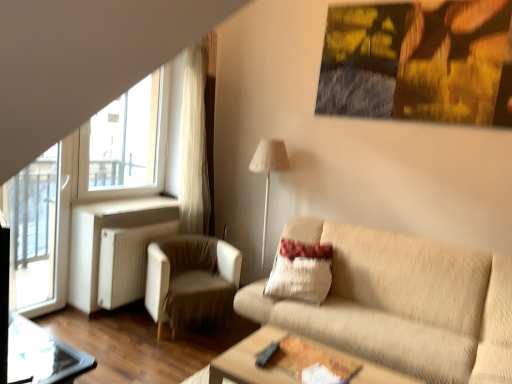
Question: From the image's perspective, is white fabric armchair at left on beige textured pillow at center?

Choices:
 (A) no
 (B) yes

Answer: (A)

Question: Considering the relative sizes of white fabric armchair at left and beige textured pillow at center in the image provided, is white fabric armchair at left wider than beige textured pillow at center?

Choices:
 (A) yes
 (B) no

Answer: (A)

Question: Is white fabric armchair at left at the right side of beige textured pillow at center?

Choices:
 (A) yes
 (B) no

Answer: (B)

Question: Does white fabric armchair at left have a smaller size compared to beige textured pillow at center?

Choices:
 (A) yes
 (B) no

Answer: (B)

Question: Is white fabric armchair at left taller than beige textured pillow at center?

Choices:
 (A) no
 (B) yes

Answer: (B)

Question: Relative to wooden table at lower center, is transparent glass table at lower left in front or behind?

Choices:
 (A) behind
 (B) front

Answer: (B)

Question: Considering the positions of transparent glass table at lower left and wooden table at lower center in the image, is transparent glass table at lower left bigger or smaller than wooden table at lower center?

Choices:
 (A) big
 (B) small

Answer: (B)

Question: Is transparent glass table at lower left situated inside wooden table at lower center or outside?

Choices:
 (A) inside
 (B) outside

Answer: (B)

Question: Is transparent glass table at lower left to the left or to the right of wooden table at lower center in the image?

Choices:
 (A) right
 (B) left

Answer: (B)

Question: From a real-world perspective, is wooden table at lower center physically located above or below transparent glass table at lower left?

Choices:
 (A) above
 (B) below

Answer: (B)

Question: From their relative heights in the image, would you say wooden table at lower center is taller or shorter than transparent glass table at lower left?

Choices:
 (A) tall
 (B) short

Answer: (B)

Question: Would you say wooden table at lower center is to the left or to the right of transparent glass table at lower left in the picture?

Choices:
 (A) left
 (B) right

Answer: (B)

Question: Is wooden table at lower center wider or thinner than transparent glass table at lower left?

Choices:
 (A) thin
 (B) wide

Answer: (B)

Question: Considering the positions of wooden table at lower center and white fabric lampshade at center in the image, is wooden table at lower center taller or shorter than white fabric lampshade at center?

Choices:
 (A) tall
 (B) short

Answer: (B)

Question: In terms of width, does wooden table at lower center look wider or thinner when compared to white fabric lampshade at center?

Choices:
 (A) wide
 (B) thin

Answer: (A)